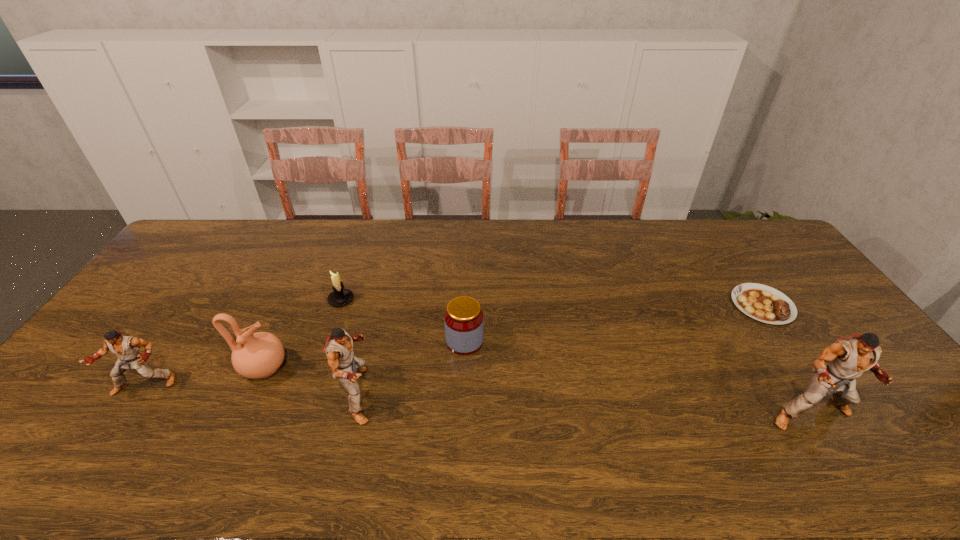
Image resolution: width=960 pixels, height=540 pixels. Find the location of `vacant position located on the front-facing side of the fourth object from left to right`. vacant position located on the front-facing side of the fourth object from left to right is located at coordinates (420, 395).

The width and height of the screenshot is (960, 540). I want to click on blank area located on the right of the fifth object from right to left, so click(417, 300).

You are a GUI agent. You are given a task and a screenshot of the screen. Output one action in this format:
    pyautogui.click(x=<x>, y=<y>)
    Task: Click on the vacant region located on the front of the shortest object
    
    Given the screenshot: What is the action you would take?
    pyautogui.click(x=813, y=379)

Locate an element on the screen. free spot located on the back of the jar is located at coordinates (468, 247).

Find the location of a particular element. vacant space located 0.270m on the spout of the pottery is located at coordinates (387, 368).

The height and width of the screenshot is (540, 960). I want to click on object positioned at the left edge, so click(126, 348).

Where is `object positioned at the right edge`? The width and height of the screenshot is (960, 540). object positioned at the right edge is located at coordinates (763, 303).

Locate an element on the screen. vacant region at the far edge of the desktop is located at coordinates 399,251.

This screenshot has height=540, width=960. I want to click on vacant space at the near edge of the desktop, so click(571, 414).

Locate an element on the screen. The width and height of the screenshot is (960, 540). vacant space at the left edge of the desktop is located at coordinates (167, 267).